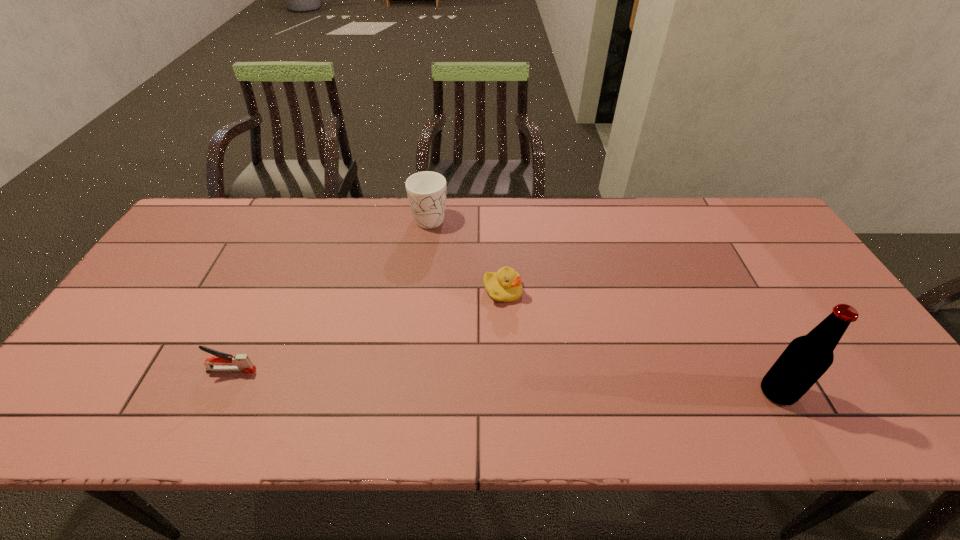
At what (x,y) coordinates should I click in order to perform the action: click on vacant area between the duckling and the farthest object. Please return your answer as a coordinate pair (x, y). Image resolution: width=960 pixels, height=540 pixels. Looking at the image, I should click on (467, 254).

The height and width of the screenshot is (540, 960). What are the coordinates of `vacant area between the rightmost object and the third object from right to left` in the screenshot? It's located at (604, 305).

The width and height of the screenshot is (960, 540). Identify the location of blank region between the leftmost object and the second object from left to right. (330, 293).

What are the coordinates of `vacant space that's between the leftmost object and the third object from left to right` in the screenshot? It's located at (367, 331).

Identify the location of object that stands as the closest to the third nearest object. This screenshot has width=960, height=540. (426, 191).

Locate which object is the third closest to the leftmost object. Please provide its 2D coordinates. Your answer should be formatted as a tuple, i.e. [(x, y)], where the tuple contains the x and y coordinates of a point satisfying the conditions above.

[(806, 358)]